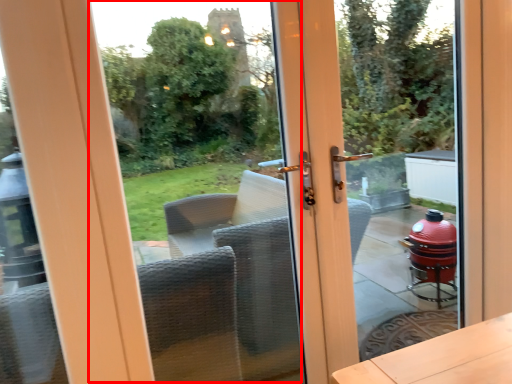
Question: From the image, what is the correct spatial relationship of window screen (annotated by the red box) in relation to glass door?

Choices:
 (A) right
 (B) left

Answer: (B)